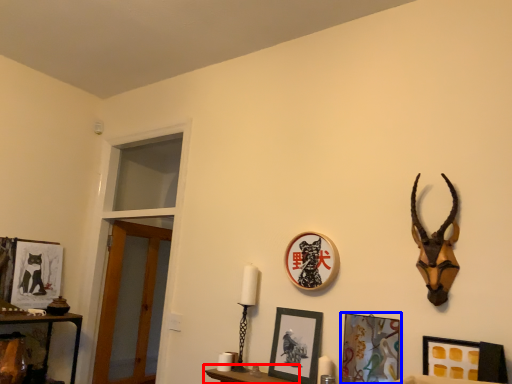
Question: Which object is closer to the camera taking this photo, furniture (highlighted by a red box) or picture frame (highlighted by a blue box)?

Choices:
 (A) furniture
 (B) picture frame

Answer: (B)